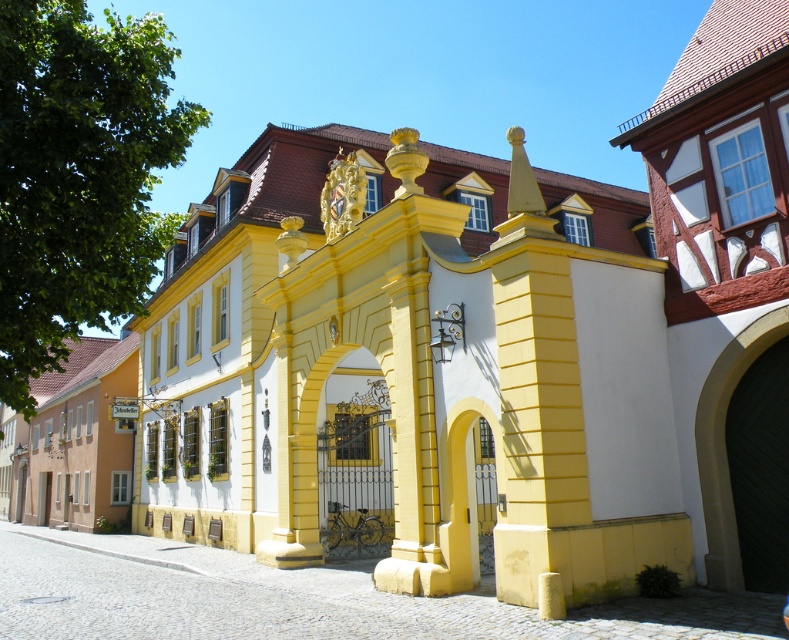
You are standing in front of the historic building and want to walk through the entrance. Which object, the beige stone archway at center or the yellow matte gate at center, should you approach first?

You should approach the beige stone archway at center first because it is closer to you than the yellow matte gate at center.

You are a tour guide leading a group to the entrance of the historic building. You need to ensure a safe path for a wheelchair user who requires a minimum of 1.5 meters of clearance. Is the distance between the beige stone archway at center and the yellow matte gate at center sufficient for the wheelchair to pass through comfortably?

The distance between the beige stone archway at center and the yellow matte gate at center is 3.74 meters, which is more than the required 1.5 meters clearance. Therefore, the wheelchair can pass through comfortably.

You are standing in front of a historic building with a grand yellow gateway. There is a point marked at coordinates (724,444). What does this point most likely represent in the scene?

The point at (724,444) corresponds to the beige stone archway at center.